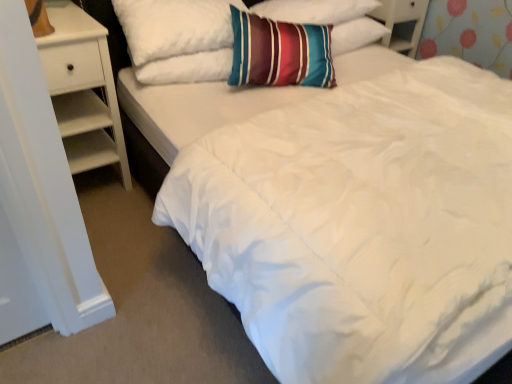
Question: Is white wood dresser at upper right completely or partially outside of white wood nightstand at left?

Choices:
 (A) yes
 (B) no

Answer: (A)

Question: Does white wood dresser at upper right appear on the left side of white wood nightstand at left?

Choices:
 (A) no
 (B) yes

Answer: (A)

Question: Considering the relative sizes of white wood dresser at upper right and white wood nightstand at left in the image provided, is white wood dresser at upper right shorter than white wood nightstand at left?

Choices:
 (A) yes
 (B) no

Answer: (A)

Question: Can you confirm if white wood dresser at upper right is positioned to the right of white wood nightstand at left?

Choices:
 (A) yes
 (B) no

Answer: (A)

Question: Is white wood dresser at upper right closer to the viewer compared to white wood nightstand at left?

Choices:
 (A) no
 (B) yes

Answer: (A)

Question: From the image's perspective, is white wood dresser at upper right under white wood nightstand at left?

Choices:
 (A) no
 (B) yes

Answer: (A)

Question: Does white wood dresser at upper right appear on the right side of striped fabric pillow at upper center, which is counted as the second pillow, starting from the right?

Choices:
 (A) yes
 (B) no

Answer: (A)

Question: Is white wood dresser at upper right bigger than striped fabric pillow at upper center, which is the 1th pillow from left to right?

Choices:
 (A) yes
 (B) no

Answer: (B)

Question: Would you say white wood dresser at upper right is a long distance from striped fabric pillow at upper center, which is the 1th pillow from left to right?

Choices:
 (A) yes
 (B) no

Answer: (B)

Question: Is the depth of white wood dresser at upper right greater than that of striped fabric pillow at upper center, which is counted as the second pillow, starting from the right?

Choices:
 (A) no
 (B) yes

Answer: (B)

Question: Can you confirm if white wood dresser at upper right is shorter than striped fabric pillow at upper center, which is counted as the second pillow, starting from the right?

Choices:
 (A) yes
 (B) no

Answer: (A)

Question: From the image's perspective, is white wood dresser at upper right located beneath striped fabric pillow at upper center, which is the 1th pillow from left to right?

Choices:
 (A) yes
 (B) no

Answer: (B)

Question: Can striped fabric pillow at upper center, which is the 1th pillow from left to right, be found inside white wood nightstand at left?

Choices:
 (A) yes
 (B) no

Answer: (B)